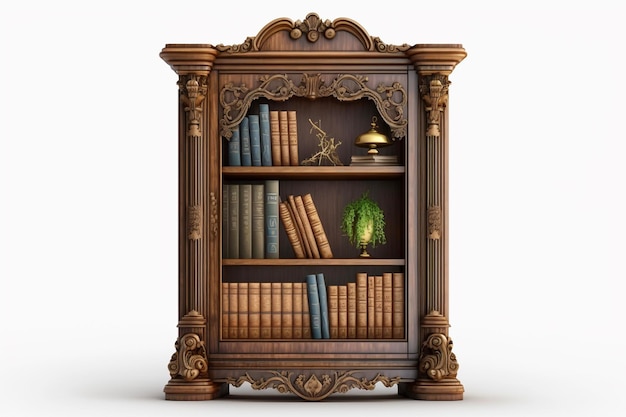
Find the location of `books on the same shelf as a plant`. books on the same shelf as a plant is located at coordinates (222, 218), (235, 218), (245, 218), (255, 218), (269, 220), (285, 226), (295, 218), (295, 209), (303, 213), (314, 215).